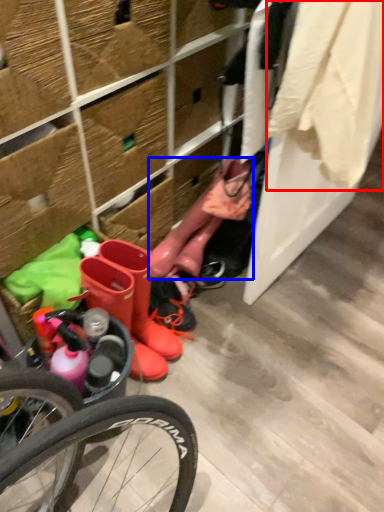
Question: Among these objects, which one is farthest to the camera, clothing (highlighted by a red box) or boot (highlighted by a blue box)?

Choices:
 (A) clothing
 (B) boot

Answer: (B)